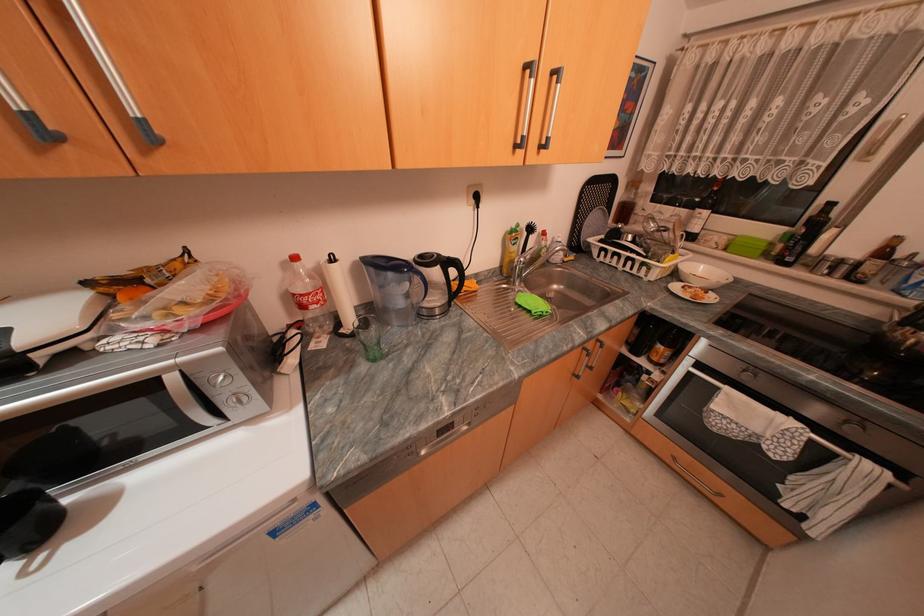
Image resolution: width=924 pixels, height=616 pixels. I want to click on microwave control dial, so click(x=219, y=379).